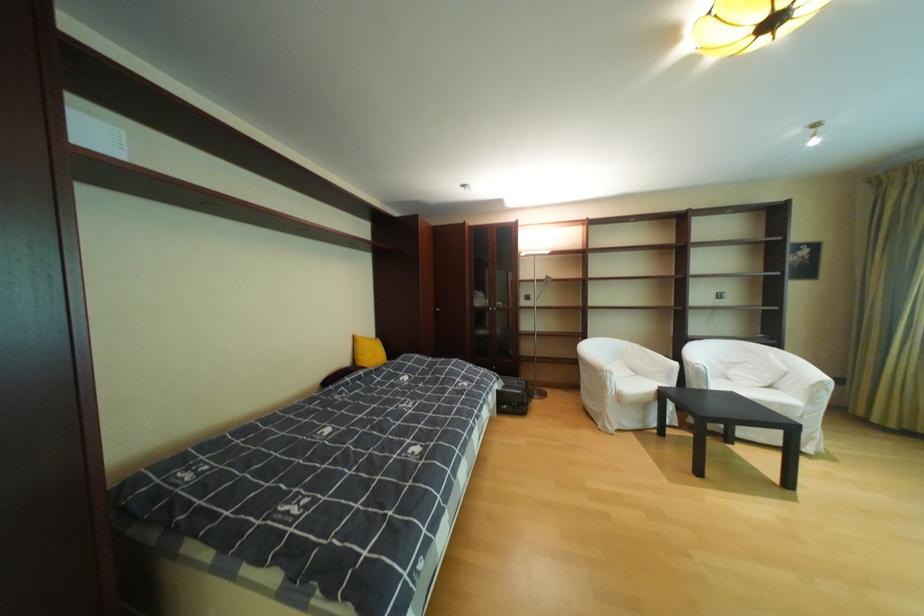
Where is `cabinet door knob`? This screenshot has width=924, height=616. cabinet door knob is located at coordinates (526, 302).